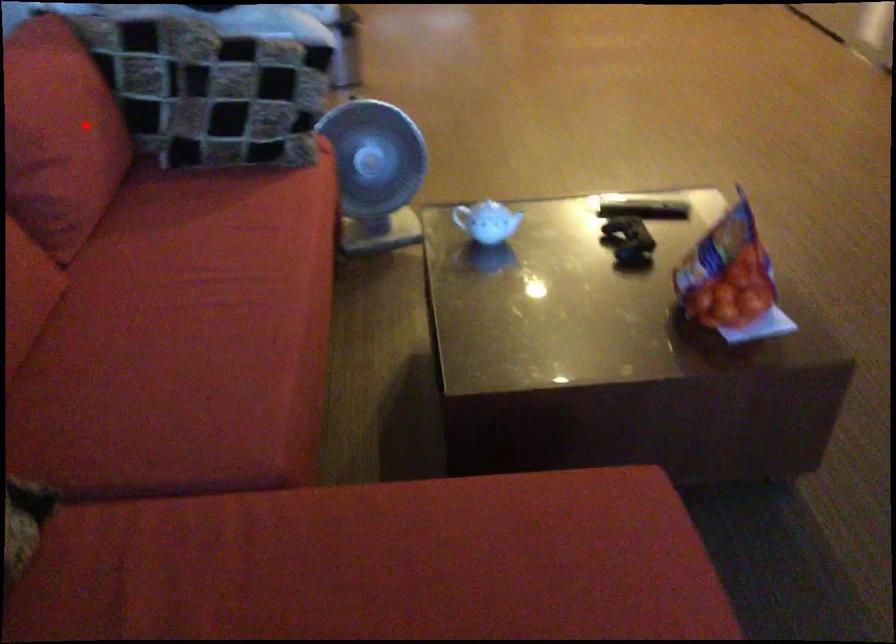
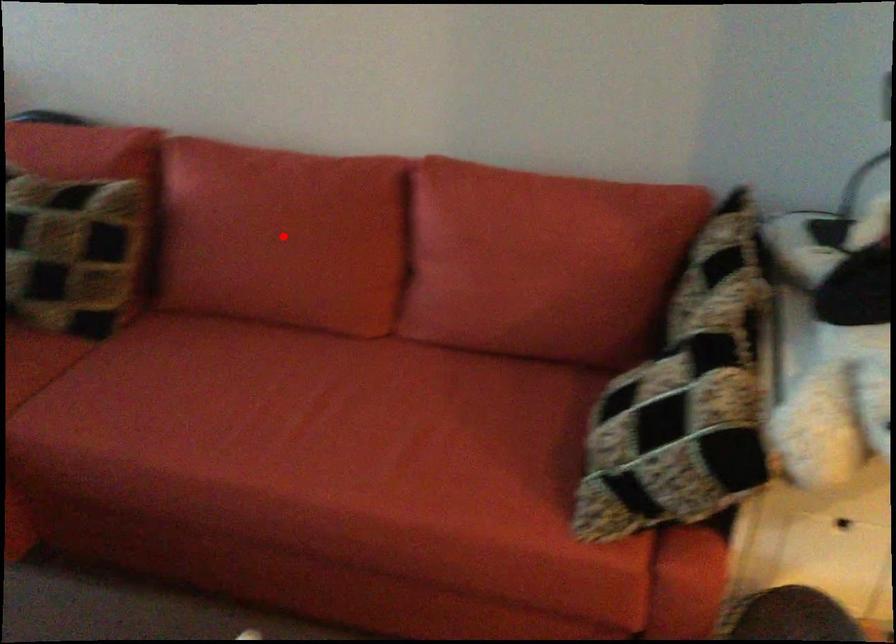
I am providing you with two images of the same scene from different viewpoints. A red point is marked on the first image and another point is marked on the second image. Is the red point in image1 aligned with the point shown in image2?

No